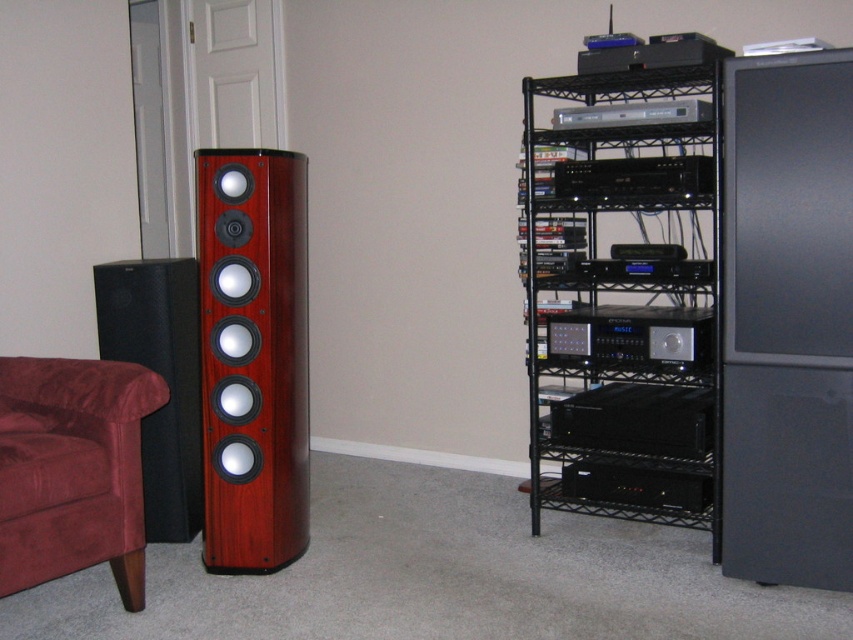
Question: In this image, where is black matte speaker at left located relative to satin black stereo at center?

Choices:
 (A) below
 (B) above

Answer: (A)

Question: Is black plastic stereo at center to the right of satin black stereo at center from the viewer's perspective?

Choices:
 (A) no
 (B) yes

Answer: (B)

Question: Which object is the closest to the black matte stereo at center-right?

Choices:
 (A) mahogany wood speaker at left
 (B) black matte stereo at center

Answer: (B)

Question: Does mahogany wood speaker at left have a greater width compared to velvet maroon armchair at lower left?

Choices:
 (A) yes
 (B) no

Answer: (B)

Question: Among these points, which one is farthest from the camera?

Choices:
 (A) (138, 589)
 (B) (572, 445)
 (C) (605, 355)

Answer: (B)

Question: Which point appears closest to the camera in this image?

Choices:
 (A) (576, 308)
 (B) (660, 490)
 (C) (606, 419)
 (D) (596, 189)

Answer: (B)